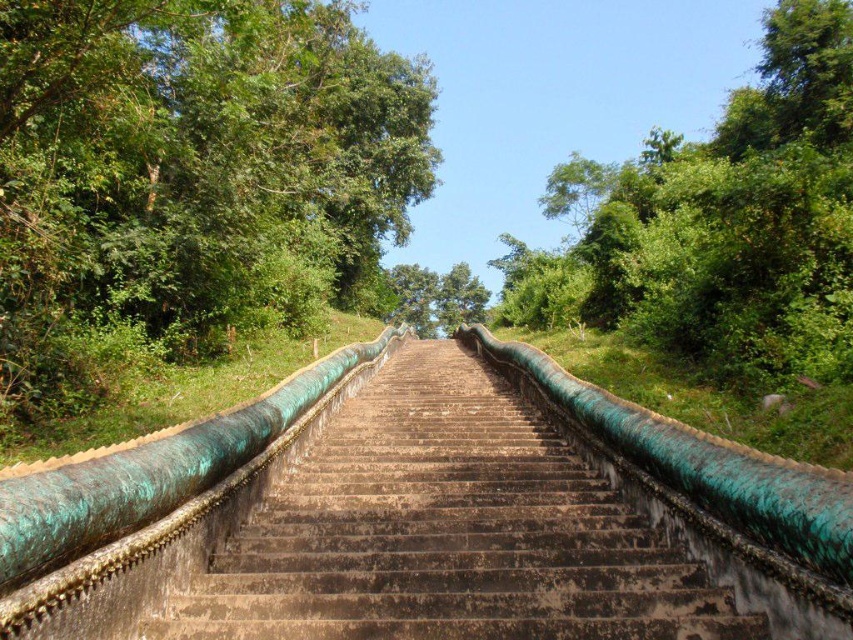
Who is shorter, green leafy tree at upper left or green patina stairs at center?

With less height is green patina stairs at center.

Is point (90, 104) less distant than point (270, 547)?

No, (90, 104) is behind (270, 547).

Is point (283, 308) farther from camera compared to point (346, 554)?

Yes.

Find the location of a particular element. Image resolution: width=853 pixels, height=640 pixels. green leafy tree at upper left is located at coordinates (189, 179).

Who is taller, green patina stairs at center or green leafy tree at upper right?

With more height is green leafy tree at upper right.

This screenshot has height=640, width=853. Describe the element at coordinates (448, 531) in the screenshot. I see `green patina stairs at center` at that location.

Image resolution: width=853 pixels, height=640 pixels. In order to click on green patina stairs at center in this screenshot , I will do `click(448, 531)`.

Does green leafy tree at upper left appear under green leafy tree at upper right?

Indeed, green leafy tree at upper left is positioned under green leafy tree at upper right.

Who is more forward, (331, 248) or (660, 188)?

Point (660, 188)

This screenshot has width=853, height=640. In order to click on green leafy tree at upper left in this screenshot , I will do `click(189, 179)`.